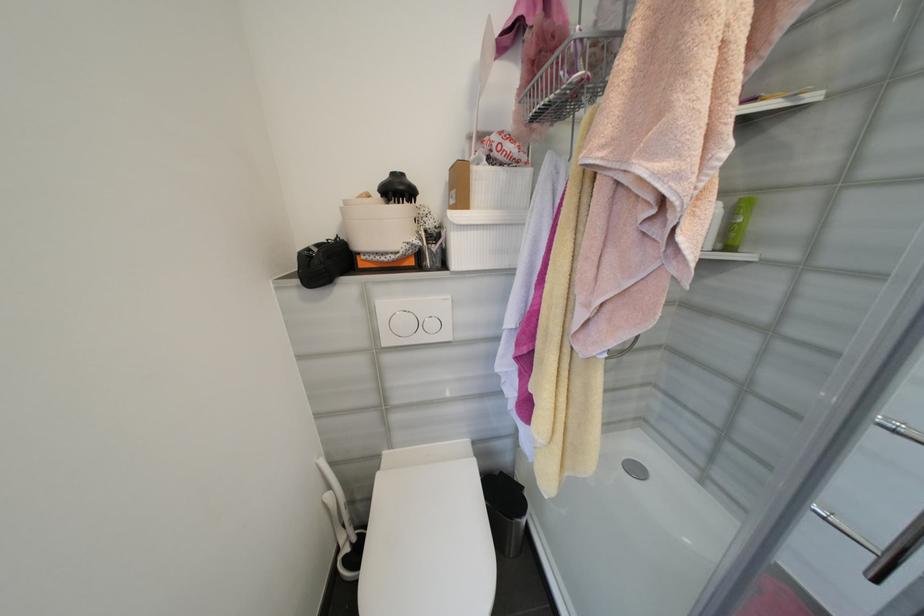
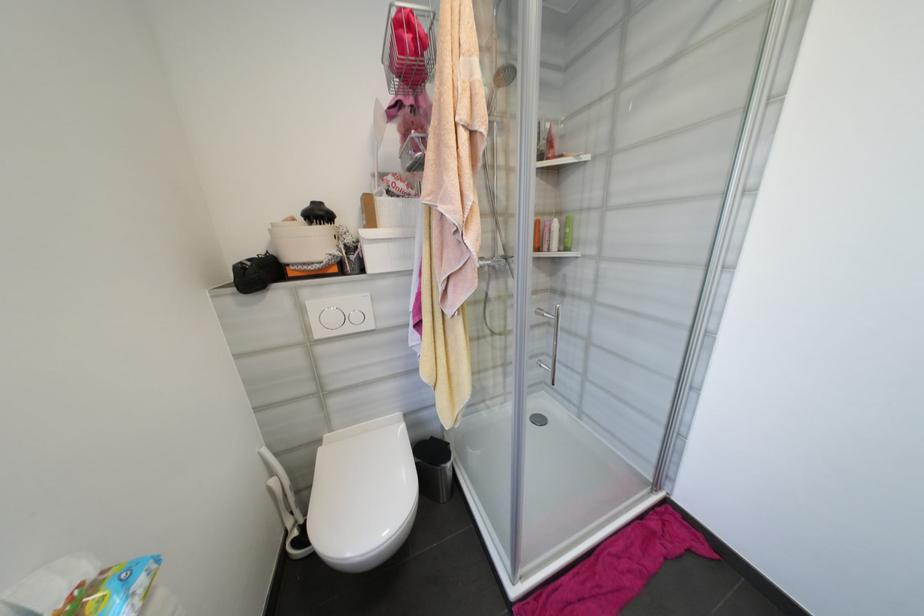
Find the pixel in the second image that matches [334,496] in the first image.

(277, 482)